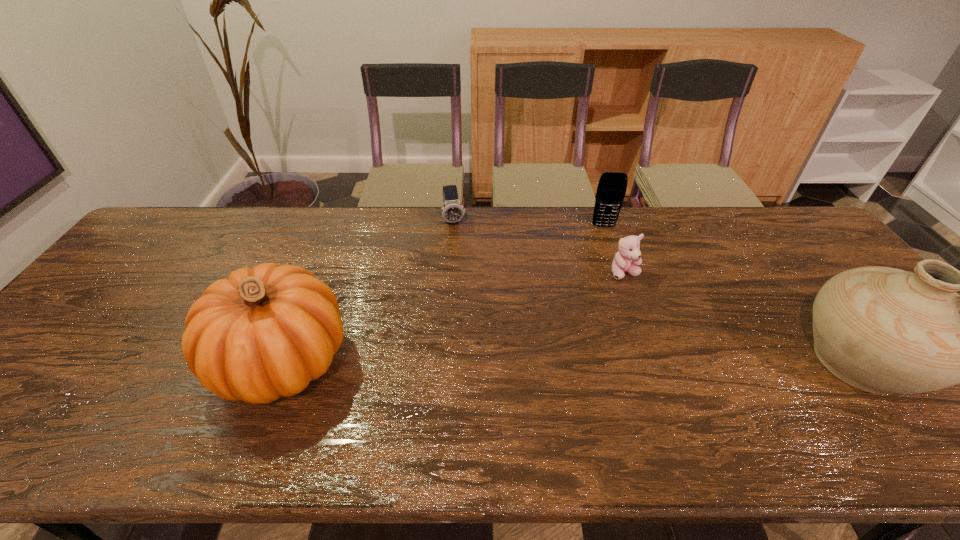
Where is `vacant space located on the face of the watch`? This screenshot has height=540, width=960. vacant space located on the face of the watch is located at coordinates (462, 261).

At what (x,y) coordinates should I click in order to perform the action: click on free spot located at the face of the teddy bear. Please return your answer as a coordinate pair (x, y). The height and width of the screenshot is (540, 960). Looking at the image, I should click on (648, 343).

Identify the location of vacant space located 0.050m at the face of the teddy bear. (633, 295).

Image resolution: width=960 pixels, height=540 pixels. I want to click on vacant space located at the face of the teddy bear, so click(x=642, y=325).

The height and width of the screenshot is (540, 960). In order to click on cellular telephone situated at the far edge in this screenshot , I will do `click(611, 190)`.

You are a GUI agent. You are given a task and a screenshot of the screen. Output one action in this format:
    pyautogui.click(x=<x>, y=<y>)
    Task: Click on the watch at the far edge
    Image resolution: width=960 pixels, height=540 pixels.
    Given the screenshot: What is the action you would take?
    pyautogui.click(x=452, y=211)

At what (x,y) coordinates should I click in order to perform the action: click on object that is at the near edge. Please return your answer as a coordinate pair (x, y). The height and width of the screenshot is (540, 960). Looking at the image, I should click on (264, 332).

Where is `vacant space at the far edge of the desktop`? This screenshot has width=960, height=540. vacant space at the far edge of the desktop is located at coordinates (291, 231).

Where is `vacant region at the near edge of the desktop`? This screenshot has width=960, height=540. vacant region at the near edge of the desktop is located at coordinates (632, 396).

Find the location of a particular element. The image size is (960, 540). vacant space at the right edge of the desktop is located at coordinates (803, 285).